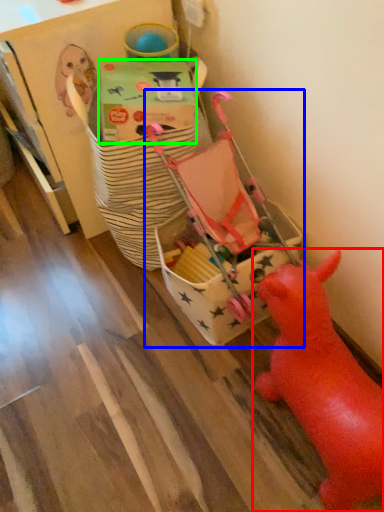
Question: Estimate the real-world distances between objects in this image. Which object is farther from toy (highlighted by a red box), toy (highlighted by a blue box) or cardboard box (highlighted by a green box)?

Choices:
 (A) toy
 (B) cardboard box

Answer: (B)